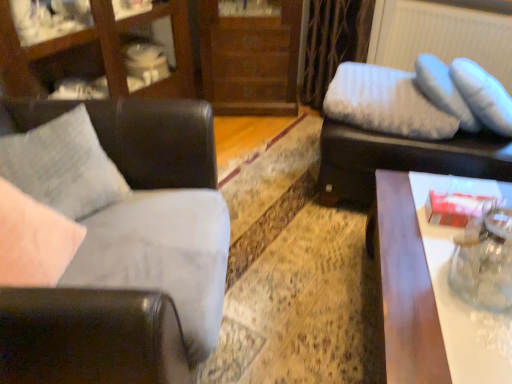
Question: Looking at the image, does matte black swivel chair at upper right seem bigger or smaller compared to textured gray pillow at left, marked as the 1th pillow in a front-to-back arrangement?

Choices:
 (A) small
 (B) big

Answer: (B)

Question: From the image's perspective, relative to textured gray pillow at left, which is the 2th pillow in right-to-left order, is matte black swivel chair at upper right above or below?

Choices:
 (A) above
 (B) below

Answer: (A)

Question: Based on their relative distances, which object is nearer to the white glossy table at right?

Choices:
 (A) leather couch at left
 (B) matte wood entertainment center at upper left
 (C) textured gray pillow at left, marked as the 1th pillow in a front-to-back arrangement
 (D) white fluffy pillow at upper right, marked as the 1th pillow in a back-to-front arrangement
 (E) matte black swivel chair at upper right

Answer: (E)

Question: Which of these objects is positioned farthest from the white fabric radiator at upper right?

Choices:
 (A) matte black swivel chair at upper right
 (B) leather couch at left
 (C) matte wood entertainment center at upper left
 (D) wooden dresser at center
 (E) white fluffy pillow at upper right, which ranks as the 2th pillow in front-to-back order

Answer: (B)